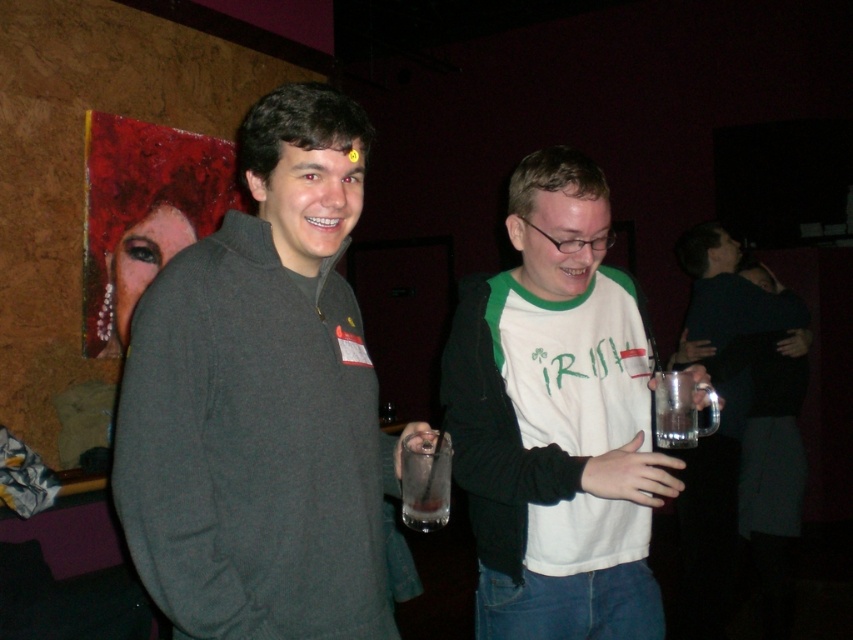
Question: Which object is positioned farthest from the clear glass at right?

Choices:
 (A) white matte t-shirt at center
 (B) clear glass at center

Answer: (B)

Question: Is dark gray sweater at center thinner than white matte t-shirt at center?

Choices:
 (A) no
 (B) yes

Answer: (B)

Question: Which of the following is the farthest from the observer?

Choices:
 (A) (267, 529)
 (B) (680, 508)
 (C) (682, 412)
 (D) (424, 461)

Answer: (B)

Question: Which is farther from the white matte t-shirt at center?

Choices:
 (A) clear glass mug at right
 (B) clear glass at center

Answer: (A)

Question: Can you confirm if dark gray sweater at center is positioned below white matte t-shirt at center?

Choices:
 (A) no
 (B) yes

Answer: (A)

Question: Where is clear glass at center located in relation to clear glass at right in the image?

Choices:
 (A) right
 (B) left

Answer: (B)